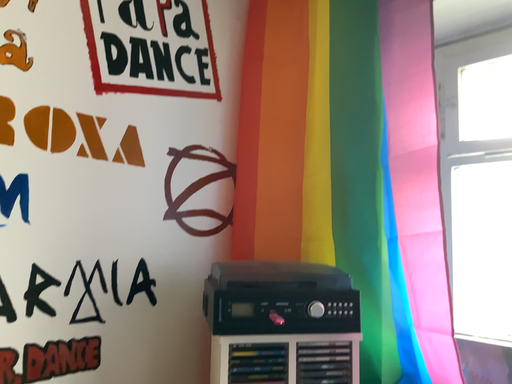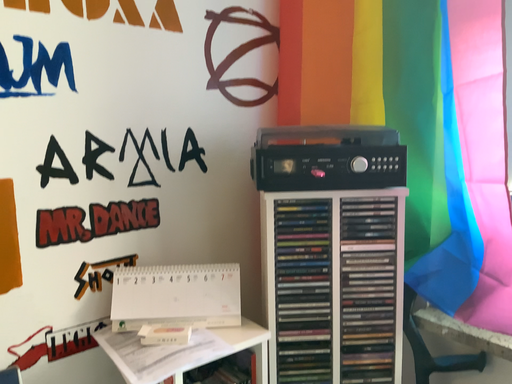
Question: Which way did the camera rotate in the video?

Choices:
 (A) rotated right
 (B) rotated left

Answer: (B)